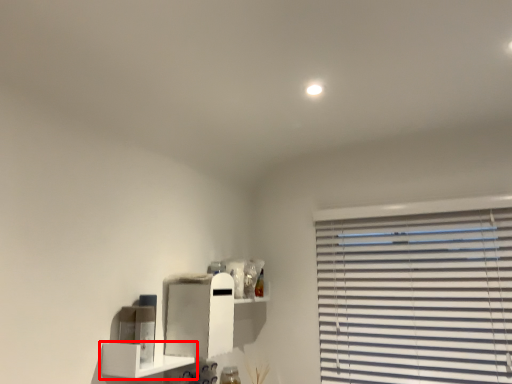
Question: From the image, what is the correct spatial relationship of shelf (annotated by the red box) in relation to cabinet?

Choices:
 (A) right
 (B) left

Answer: (B)